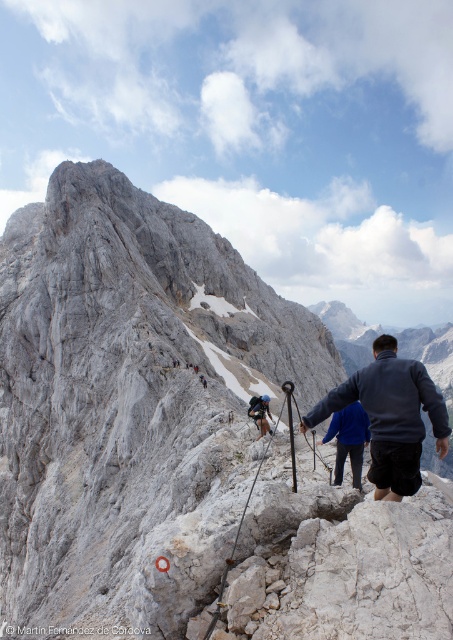
Who is taller, dark gray jacket at center or dark blue jacket at center?

With more height is dark gray jacket at center.

Is dark gray jacket at center smaller than dark blue jacket at center?

Actually, dark gray jacket at center might be larger than dark blue jacket at center.

Identify the location of dark gray jacket at center. The height and width of the screenshot is (640, 453). (390, 417).